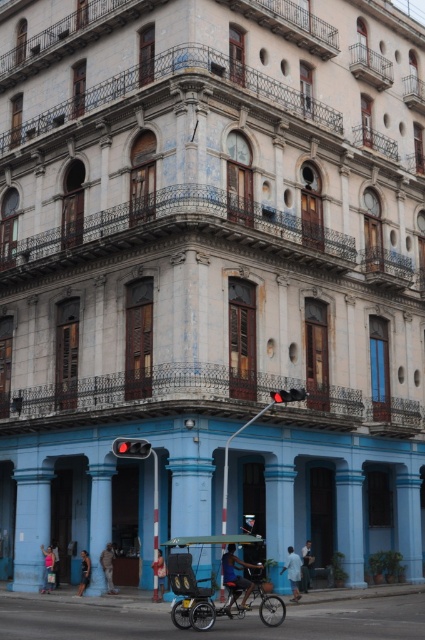
Does metallic silver bicycle at center appear on the right side of red plastic traffic light at center?

In fact, metallic silver bicycle at center is to the left of red plastic traffic light at center.

Measure the distance between metallic silver bicycle at center and camera.

A distance of 124.82 feet exists between metallic silver bicycle at center and camera.

Who is more forward, (192, 602) or (291, 390)?

Positioned in front is point (192, 602).

I want to click on metallic silver bicycle at center, so click(235, 600).

The width and height of the screenshot is (425, 640). What do you see at coordinates (306, 564) in the screenshot? I see `light blue shorts at lower center` at bounding box center [306, 564].

Locate an element on the screen. light blue shorts at lower center is located at coordinates (306, 564).

Where is `light blue shorts at lower center`? light blue shorts at lower center is located at coordinates (306, 564).

Can you confirm if red plastic traffic light at center is smaller than dark blue jeans at lower left?

Incorrect, red plastic traffic light at center is not smaller in size than dark blue jeans at lower left.

What do you see at coordinates (288, 396) in the screenshot? I see `red plastic traffic light at center` at bounding box center [288, 396].

Where is `red plastic traffic light at center`? This screenshot has height=640, width=425. red plastic traffic light at center is located at coordinates (288, 396).